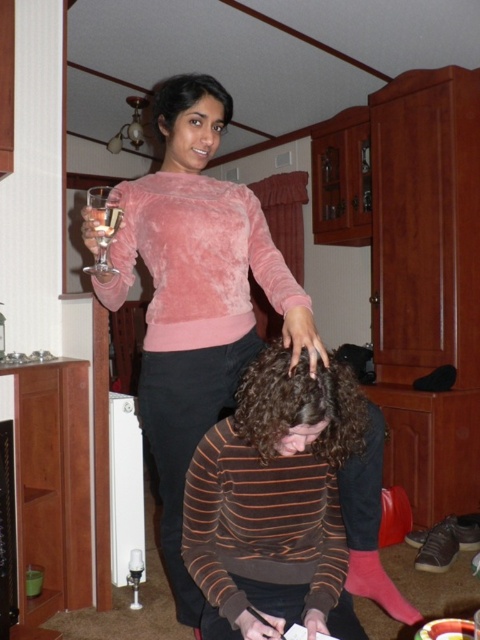
Question: Which point is farther to the camera?

Choices:
 (A) velvet pink sweater at upper center
 (B) clear glass wine glass at upper left

Answer: (B)

Question: Can you confirm if velvet pink sweater at upper center is bigger than clear glass wine glass at upper left?

Choices:
 (A) no
 (B) yes

Answer: (B)

Question: Does velvet pink sweater at upper center come behind clear glass wine glass at upper left?

Choices:
 (A) yes
 (B) no

Answer: (B)

Question: Which point is farther to the camera?

Choices:
 (A) (119, 285)
 (B) (96, 241)

Answer: (A)

Question: Does velvet pink sweater at upper center have a larger size compared to clear glass wine glass at upper left?

Choices:
 (A) yes
 (B) no

Answer: (A)